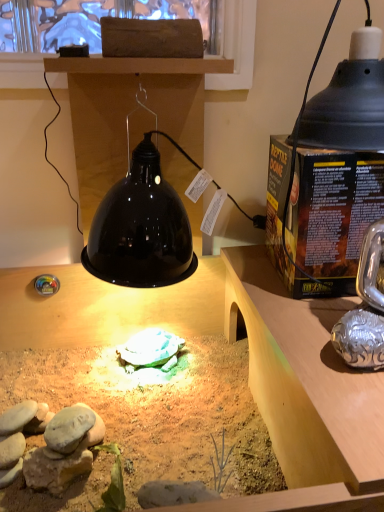
Question: From the image's perspective, relative to wooden desk at center, is black matte lampshade at upper right above or below?

Choices:
 (A) below
 (B) above

Answer: (B)

Question: Visually, is black matte lampshade at upper right positioned to the left or to the right of wooden desk at center?

Choices:
 (A) left
 (B) right

Answer: (B)

Question: From their relative heights in the image, would you say black matte lampshade at upper right is taller or shorter than wooden desk at center?

Choices:
 (A) short
 (B) tall

Answer: (A)

Question: In terms of width, does wooden desk at center look wider or thinner when compared to black matte lampshade at upper right?

Choices:
 (A) wide
 (B) thin

Answer: (A)

Question: Is wooden desk at center situated inside black matte lampshade at upper right or outside?

Choices:
 (A) outside
 (B) inside

Answer: (A)

Question: Considering the positions of point (319, 506) and point (324, 113), is point (319, 506) closer or farther from the camera than point (324, 113)?

Choices:
 (A) closer
 (B) farther

Answer: (A)

Question: Considering their positions, is wooden desk at center located in front of or behind black matte lampshade at upper right?

Choices:
 (A) behind
 (B) front

Answer: (B)